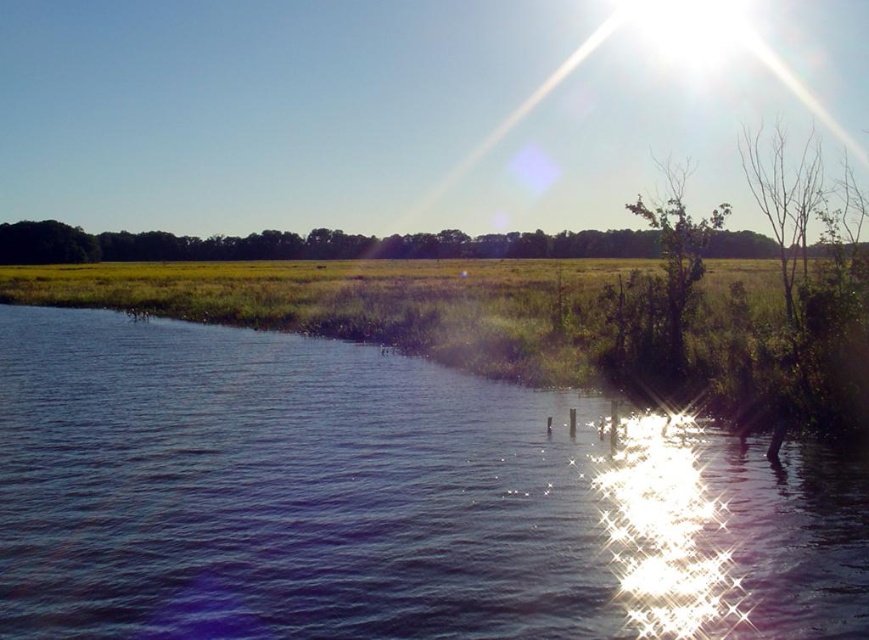
Does blue water at center have a lesser width compared to green leafy tree at upper right?

Indeed, blue water at center has a lesser width compared to green leafy tree at upper right.

Between point (87, 419) and point (705, 227), which one is positioned in front?

Point (87, 419)

The width and height of the screenshot is (869, 640). I want to click on blue water at center, so click(x=383, y=500).

Is point (695, 560) farther from viewer compared to point (800, 236)?

No.

This screenshot has width=869, height=640. Describe the element at coordinates (383, 500) in the screenshot. I see `blue water at center` at that location.

Where is `blue water at center`? This screenshot has width=869, height=640. blue water at center is located at coordinates click(383, 500).

Can you confirm if green matte tree at upper center is positioned below green leafy tree at upper right?

Yes.

Is green matte tree at upper center bigger than green leafy tree at upper right?

Correct, green matte tree at upper center is larger in size than green leafy tree at upper right.

Measure the distance between point (604, 237) and camera.

Point (604, 237) is 524.24 feet away from camera.

Find the location of a particular element. green matte tree at upper center is located at coordinates (306, 244).